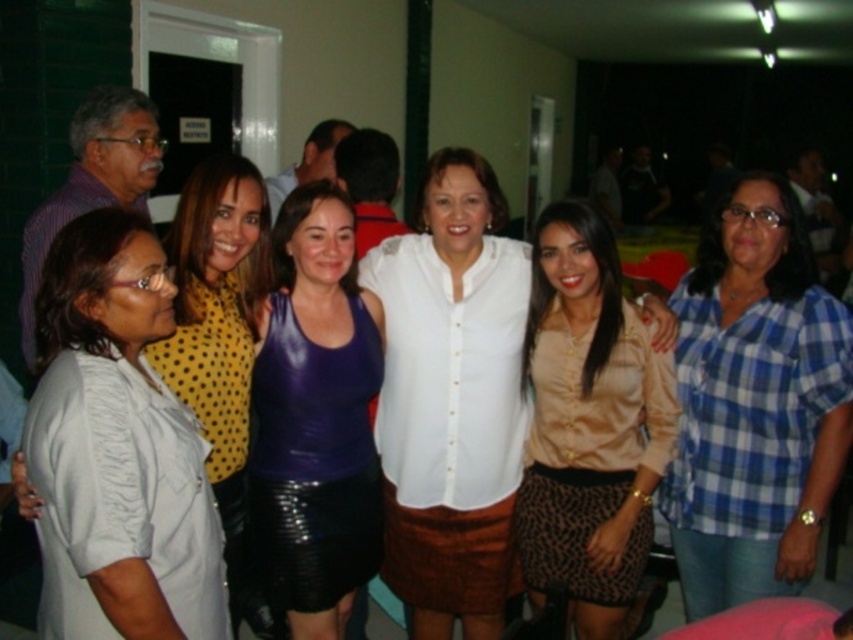
Where is the white satin blouse at left located in the image?

The white satin blouse at left is located at point (117, 449) in the image.

You are standing in the room where the group is posing. If you want to take a photo of the group, where should you position yourself to ensure the point at coordinates (x=376, y=328) is clearly visible in the frame?

You should position yourself 7.35 feet away from the point at coordinates (x=376, y=328) to ensure it is clearly visible in the frame.